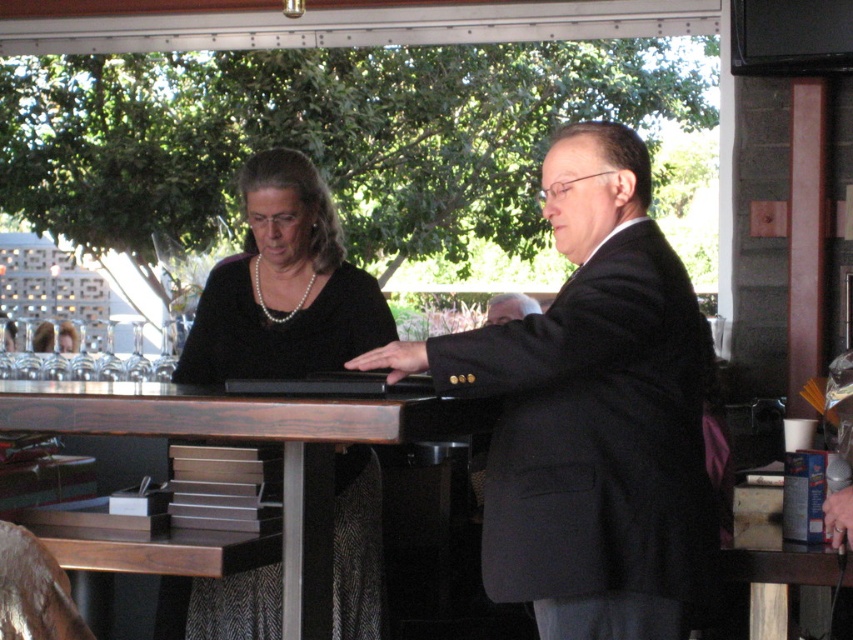
You are organizing a small event and need to place a 12 inch by 12 inch square decoration on the dark wood table at center. The matte black laptop at center is already placed there. Can the decoration fit on the table without overlapping the laptop?

The dark wood table at center is larger in size than the matte black laptop at center. Since the table is bigger, there should be enough space to place the 12x12 inch decoration without overlapping the laptop.

You are organizing a small gathering and need to place a large centerpiece on the dark wood table at center. Considering the black matte suit at center is currently occupying space on the table, can you fit the centerpiece without moving the suit?

The black matte suit at center occupies less space than the dark wood table at center, so there should be enough room to place the large centerpiece on the dark wood table at center without moving the suit.

You are a bartender preparing to place a 40 cm long bottle on the counter between the black matte suit at center and the dark wood table at center. Can the bottle fit in that space?

The black matte suit at center is 39.26 centimeters from the dark wood table at center. Since the bottle is 40 cm long, it cannot fit in the available space.